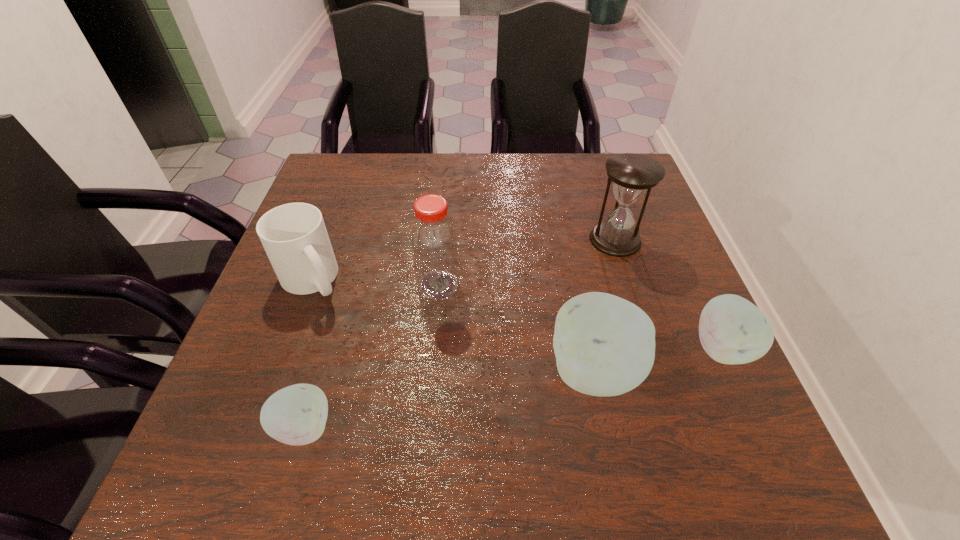
Identify the location of vacant area at the near edge of the desktop. Image resolution: width=960 pixels, height=540 pixels. (556, 401).

Identify the location of vacant space at the left edge of the desktop. tap(261, 333).

You are a GUI agent. You are given a task and a screenshot of the screen. Output one action in this format:
    pyautogui.click(x=<x>, y=<y>)
    Task: Click on the free region at the right edge of the desktop
    
    Given the screenshot: What is the action you would take?
    pyautogui.click(x=663, y=316)

At what (x,y) coordinates should I click in order to perform the action: click on free location at the far left corner of the desktop. Please return your answer as a coordinate pair (x, y). Looking at the image, I should click on (356, 183).

Locate an element on the screen. free space between the rightmost apple and the shortest apple is located at coordinates (512, 388).

Locate an element on the screen. free space between the tallest apple and the leftmost apple is located at coordinates pyautogui.click(x=449, y=400).

The image size is (960, 540). Identify the location of vacant region between the shortest object and the rightmost object. (512, 388).

Image resolution: width=960 pixels, height=540 pixels. I want to click on vacant point located between the leftmost apple and the mug, so click(308, 354).

At what (x,y) coordinates should I click in order to perform the action: click on vacant area that lies between the second apple from left to right and the leftmost apple. Please return your answer as a coordinate pair (x, y). Looking at the image, I should click on (449, 400).

Locate an element on the screen. The image size is (960, 540). free space between the leftmost apple and the mug is located at coordinates (308, 354).